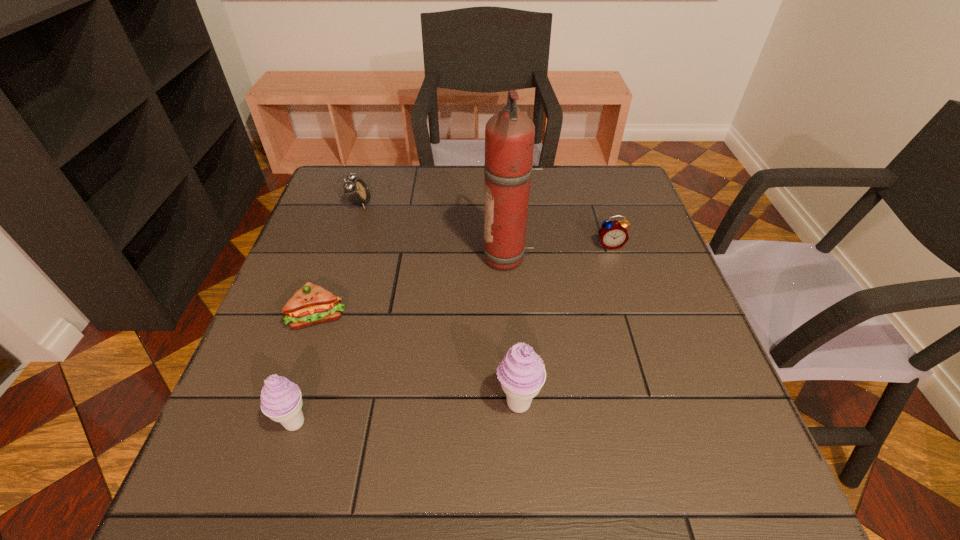
What are the coordinates of `free location that satisfies the following two spatial constraints: 1. on the side of the fifth shortest object with the label and nozzle; 2. on the right side of the tallest object` in the screenshot? It's located at (517, 403).

This screenshot has height=540, width=960. Find the location of `free space that satisfies the following two spatial constraints: 1. on the side of the fire extinguisher with the label and nozzle; 2. on the front side of the fourth shortest object`. free space that satisfies the following two spatial constraints: 1. on the side of the fire extinguisher with the label and nozzle; 2. on the front side of the fourth shortest object is located at coordinates (518, 422).

Locate an element on the screen. free space in the image that satisfies the following two spatial constraints: 1. on the front side of the left icecream; 2. on the right side of the third nearest object is located at coordinates (283, 422).

At what (x,y) coordinates should I click in order to perform the action: click on vacant space that satisfies the following two spatial constraints: 1. on the face of the farthest object; 2. on the front side of the fourth farthest object. Please return your answer as a coordinate pair (x, y). Image resolution: width=960 pixels, height=540 pixels. Looking at the image, I should click on (324, 316).

The width and height of the screenshot is (960, 540). I want to click on free point that satisfies the following two spatial constraints: 1. on the side of the taller icecream with the label and nozzle; 2. on the left side of the tallest object, so click(x=517, y=403).

The height and width of the screenshot is (540, 960). What are the coordinates of `free space that satisfies the following two spatial constraints: 1. on the face of the right icecream; 2. on the right side of the left alarm clock` in the screenshot? It's located at (296, 403).

The height and width of the screenshot is (540, 960). I want to click on free space that satisfies the following two spatial constraints: 1. on the side of the second tallest object with the label and nozzle; 2. on the left side of the fire extinguisher, so click(x=517, y=403).